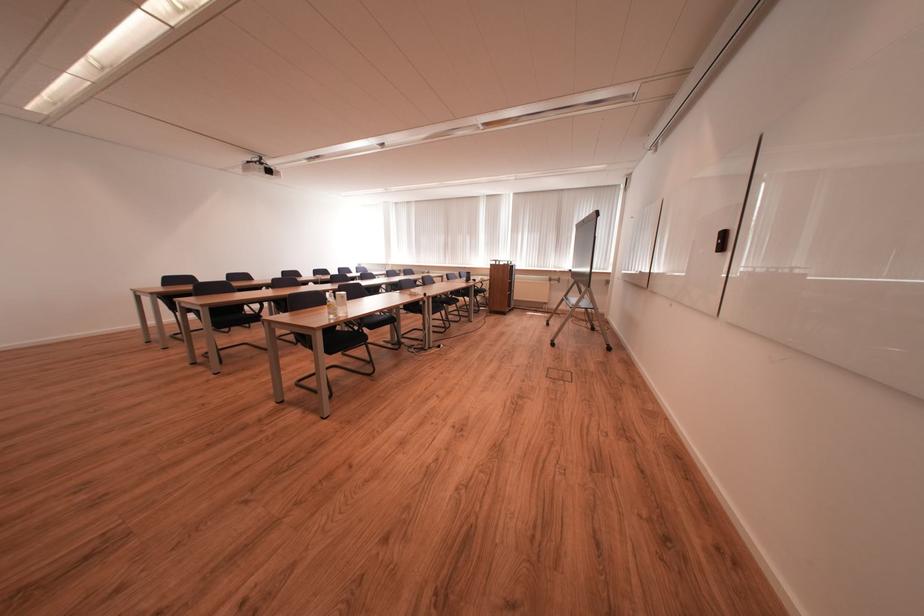
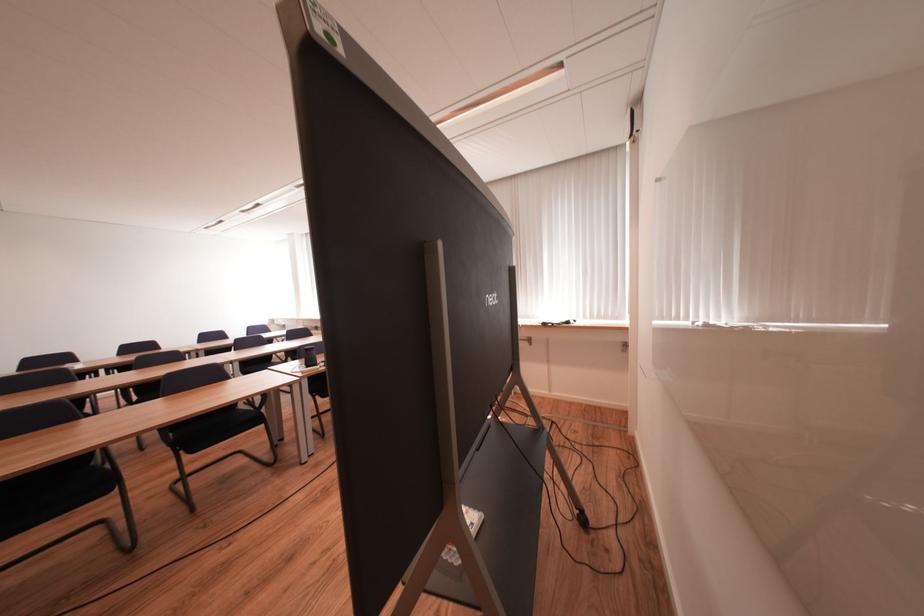
Which direction would the cameraman need to move to produce the second image?

The movement direction of the cameraman is right, forward.